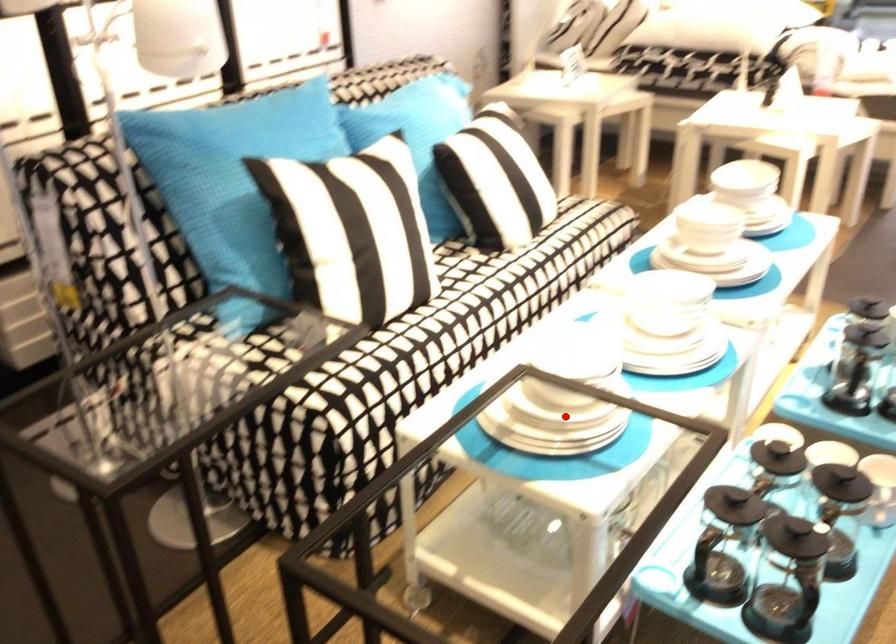
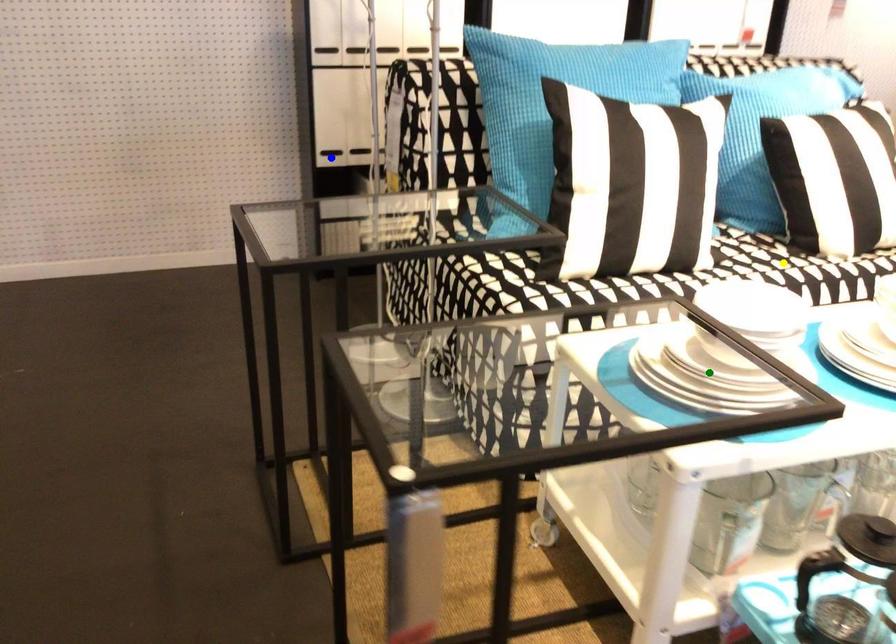
Question: I am providing you with two images of the same scene from different viewpoints. A red point is marked on the first image. You are given multiple points on the second image. Which spot in image 2 lines up with the point in image 1?

Choices:
 (A) yellow point
 (B) green point
 (C) blue point

Answer: (B)